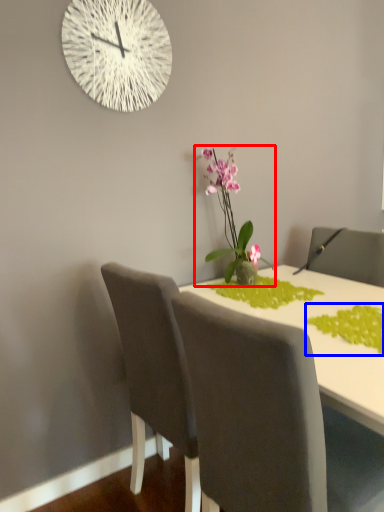
Question: Among these objects, which one is farthest to the camera, houseplant (highlighted by a red box) or plant (highlighted by a blue box)?

Choices:
 (A) houseplant
 (B) plant

Answer: (A)